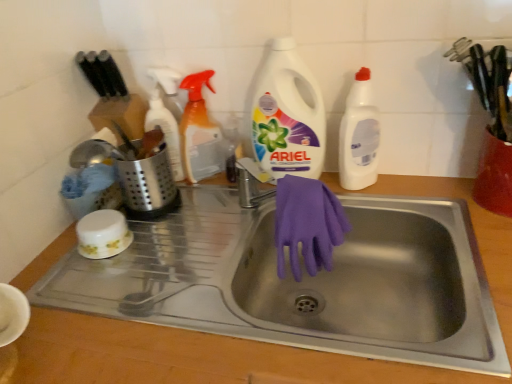
Question: Considering the relative sizes of white plastic detergent at center, marked as the 3th cleaning product in a left-to-right arrangement, and red plastic container at upper right, the second appliance viewed from the left, in the image provided, is white plastic detergent at center, marked as the 3th cleaning product in a left-to-right arrangement, smaller than red plastic container at upper right, the second appliance viewed from the left,?

Choices:
 (A) no
 (B) yes

Answer: (A)

Question: From the image's perspective, is white plastic detergent at center, acting as the 2th cleaning product starting from the right, above red plastic container at upper right, the 1th appliance viewed from the right?

Choices:
 (A) yes
 (B) no

Answer: (A)

Question: Is white plastic detergent at center, acting as the 2th cleaning product starting from the right, at the left side of red plastic container at upper right, the second appliance viewed from the left?

Choices:
 (A) yes
 (B) no

Answer: (A)

Question: Considering the relative sizes of white plastic detergent at center, acting as the 2th cleaning product starting from the right, and red plastic container at upper right, the 1th appliance viewed from the right, in the image provided, is white plastic detergent at center, acting as the 2th cleaning product starting from the right, shorter than red plastic container at upper right, the 1th appliance viewed from the right,?

Choices:
 (A) yes
 (B) no

Answer: (B)

Question: Can you confirm if white plastic detergent at center, acting as the 2th cleaning product starting from the right, is wider than red plastic container at upper right, the 1th appliance viewed from the right?

Choices:
 (A) yes
 (B) no

Answer: (B)

Question: From a real-world perspective, does white plastic detergent at center, acting as the 2th cleaning product starting from the right, stand above red plastic container at upper right, the second appliance viewed from the left?

Choices:
 (A) yes
 (B) no

Answer: (A)

Question: From a real-world perspective, is purple rubber gloves at sink located higher than translucent orange spray bottle at upper center, which appears as the second cleaning product when viewed from the left?

Choices:
 (A) yes
 (B) no

Answer: (B)

Question: From the image's perspective, is purple rubber gloves at sink on translucent orange spray bottle at upper center, marked as the third cleaning product in a right-to-left arrangement?

Choices:
 (A) no
 (B) yes

Answer: (A)

Question: Does purple rubber gloves at sink contain translucent orange spray bottle at upper center, which appears as the second cleaning product when viewed from the left?

Choices:
 (A) yes
 (B) no

Answer: (B)

Question: Considering the relative sizes of purple rubber gloves at sink and translucent orange spray bottle at upper center, which appears as the second cleaning product when viewed from the left, in the image provided, is purple rubber gloves at sink bigger than translucent orange spray bottle at upper center, which appears as the second cleaning product when viewed from the left,?

Choices:
 (A) no
 (B) yes

Answer: (A)

Question: Is purple rubber gloves at sink thinner than translucent orange spray bottle at upper center, which appears as the second cleaning product when viewed from the left?

Choices:
 (A) yes
 (B) no

Answer: (A)

Question: Is purple rubber gloves at sink outside translucent orange spray bottle at upper center, marked as the third cleaning product in a right-to-left arrangement?

Choices:
 (A) yes
 (B) no

Answer: (A)

Question: Is translucent orange spray bottle at upper center, marked as the third cleaning product in a right-to-left arrangement, oriented towards satin silver utensil holder at left, which is counted as the 2th appliance, starting from the right?

Choices:
 (A) no
 (B) yes

Answer: (B)